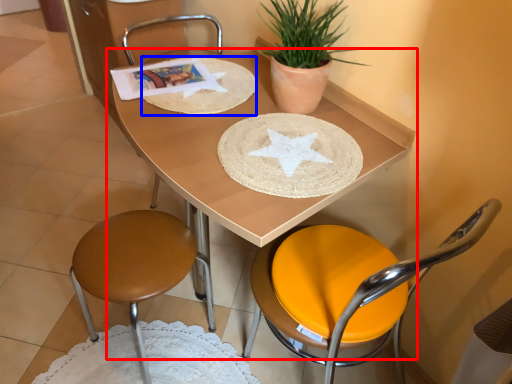
Question: Which point is further to the camera, table (highlighted by a red box) or paper plate (highlighted by a blue box)?

Choices:
 (A) table
 (B) paper plate

Answer: (B)